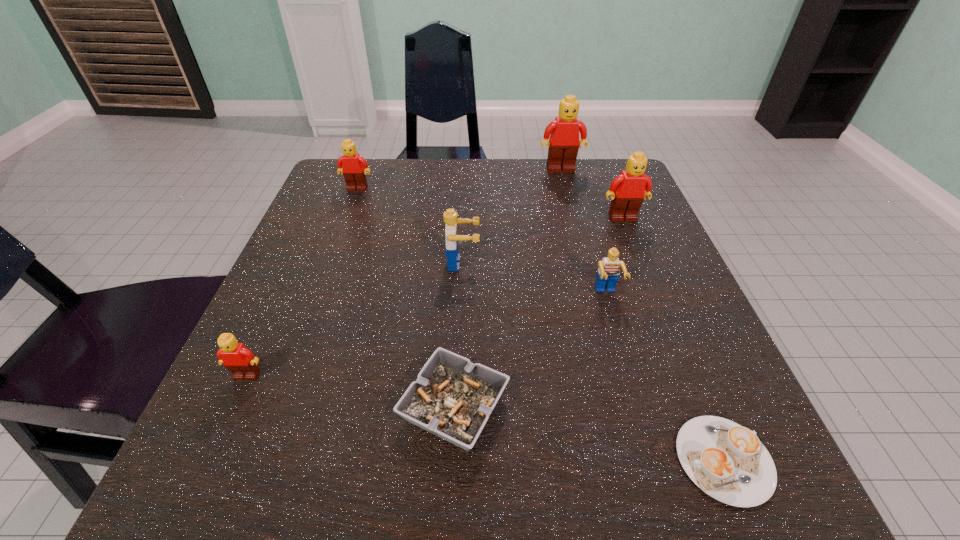
Where is `the smallest brown Lego`? The width and height of the screenshot is (960, 540). the smallest brown Lego is located at coordinates (238, 359).

I want to click on the nearest Lego, so coord(238,359).

Locate an element on the screen. Image resolution: width=960 pixels, height=540 pixels. the seventh tallest object is located at coordinates (452, 398).

The height and width of the screenshot is (540, 960). In order to click on gray ashtray in this screenshot , I will do `click(452, 398)`.

Find the location of a particular element. The height and width of the screenshot is (540, 960). white cappuccino is located at coordinates (727, 461).

Where is `the shortest object`? This screenshot has height=540, width=960. the shortest object is located at coordinates (727, 461).

At what (x,y) coordinates should I click in order to perform the action: click on free point located 0.230m on the face of the second brown Lego from right to left. Please return your answer as a coordinate pair (x, y). Looking at the image, I should click on (577, 232).

Where is `blank space located on the face of the third smallest brown Lego`? Image resolution: width=960 pixels, height=540 pixels. blank space located on the face of the third smallest brown Lego is located at coordinates tap(657, 303).

You are a GUI agent. You are given a task and a screenshot of the screen. Output one action in this format:
    pyautogui.click(x=<x>, y=<y>)
    Task: Click on the vacant space located on the face of the bigger blue Lego
    The width and height of the screenshot is (960, 540).
    Given the screenshot: What is the action you would take?
    [569, 263]

You are a GUI agent. You are given a task and a screenshot of the screen. Output one action in this format:
    pyautogui.click(x=<x>, y=<y>)
    Task: Click on the free location located on the face of the seventh nearest object
    
    Given the screenshot: What is the action you would take?
    pyautogui.click(x=331, y=257)